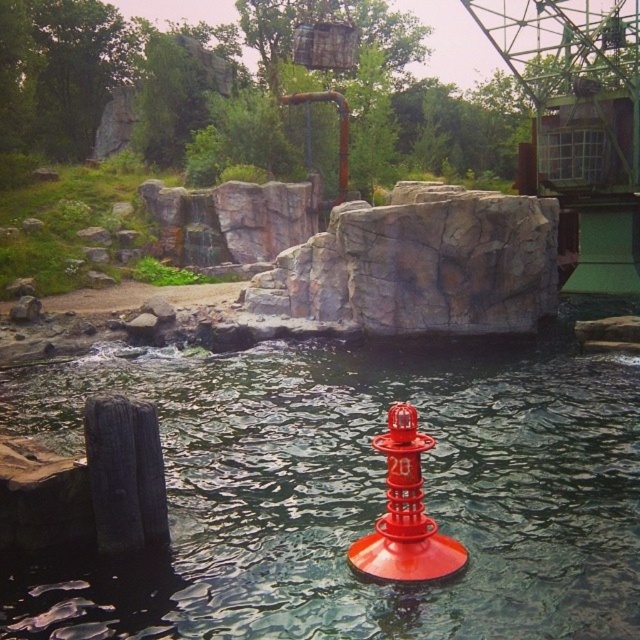
Can you confirm if glossy plastic water at center is thinner than red matte buoy at center?

No, glossy plastic water at center is not thinner than red matte buoy at center.

Does point (618, 481) come behind point (397, 481)?

Yes, point (618, 481) is behind point (397, 481).

Find the location of a particular element. glossy plastic water at center is located at coordinates (356, 490).